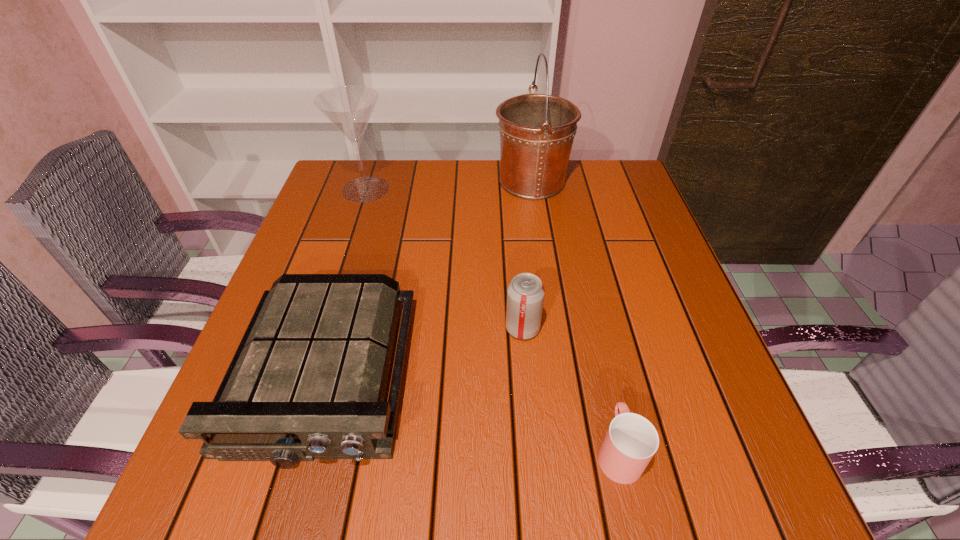
You are a GUI agent. You are given a task and a screenshot of the screen. Output one action in this format:
    pyautogui.click(x=<x>, y=<y>)
    Task: Click on the bucket
    
    Given the screenshot: What is the action you would take?
    pyautogui.click(x=537, y=131)

The width and height of the screenshot is (960, 540). What are the coordinates of `flute glass` in the screenshot? It's located at (349, 108).

Where is `soda can`? soda can is located at coordinates (525, 294).

Find the location of `radio receiver`. radio receiver is located at coordinates (308, 380).

Where is `cup`? cup is located at coordinates (631, 441).

This screenshot has height=540, width=960. In order to click on vacant space located on the front of the bucket in this screenshot , I will do click(x=552, y=316).

You are a GUI agent. You are given a task and a screenshot of the screen. Output one action in this format:
    pyautogui.click(x=<x>, y=<y>)
    Task: Click on the free region located 0.150m on the right of the second tallest object
    The image size is (960, 540).
    Given the screenshot: What is the action you would take?
    pyautogui.click(x=447, y=189)

At what (x,y) coordinates should I click in order to perform the action: click on free space located 0.090m on the right of the third shortest object. Please return your answer as a coordinate pair (x, y). Looking at the image, I should click on (585, 328).

What are the coordinates of `free space located on the side of the cup with the handle` in the screenshot? It's located at (582, 288).

Where is `blank space located 0.060m on the side of the cup with the handle`? This screenshot has width=960, height=540. blank space located 0.060m on the side of the cup with the handle is located at coordinates (605, 390).